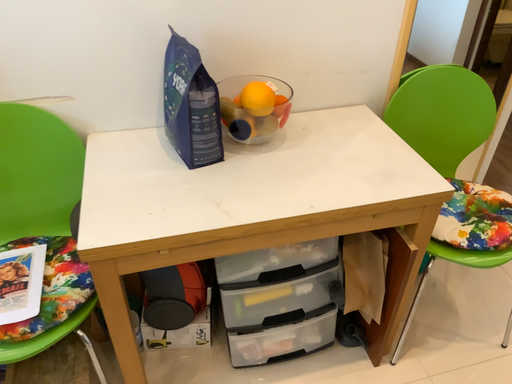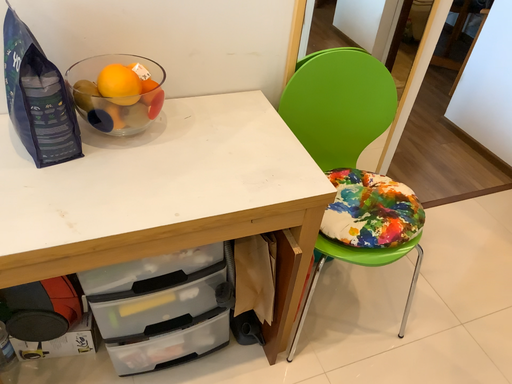
Question: How did the camera likely rotate when shooting the video?

Choices:
 (A) rotated left
 (B) rotated right

Answer: (B)